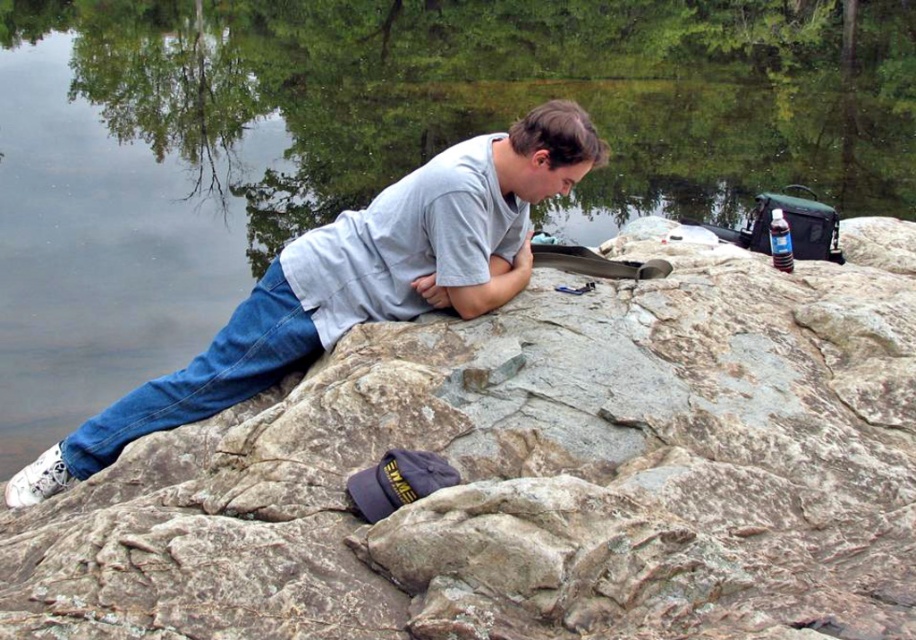
You are a photographer planning to take a portrait of the person in the scene. You want to ensure the gray cotton shirt at center is visible above the gray rough rock at center. Based on the scene description, will this be possible?

The gray rough rock at center is below the gray cotton shirt at center, so yes, the gray cotton shirt at center will be visible above the gray rough rock at center in the portrait.

You are a photographer trying to capture the scene of the gray rough rock at center and the gray cotton shirt at center. If you want to ensure both objects are in focus, what should you consider about their distance?

The gray rough rock at center is 23.27 inches from the gray cotton shirt at center. To ensure both are in focus, the photographer should use a small aperture setting to increase the depth of field, allowing both objects at different distances to be sharp.